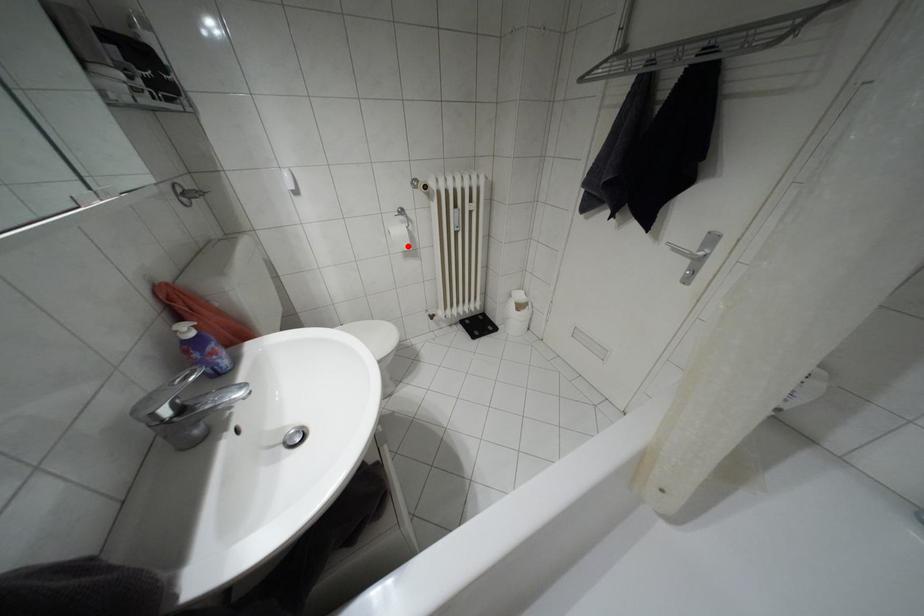
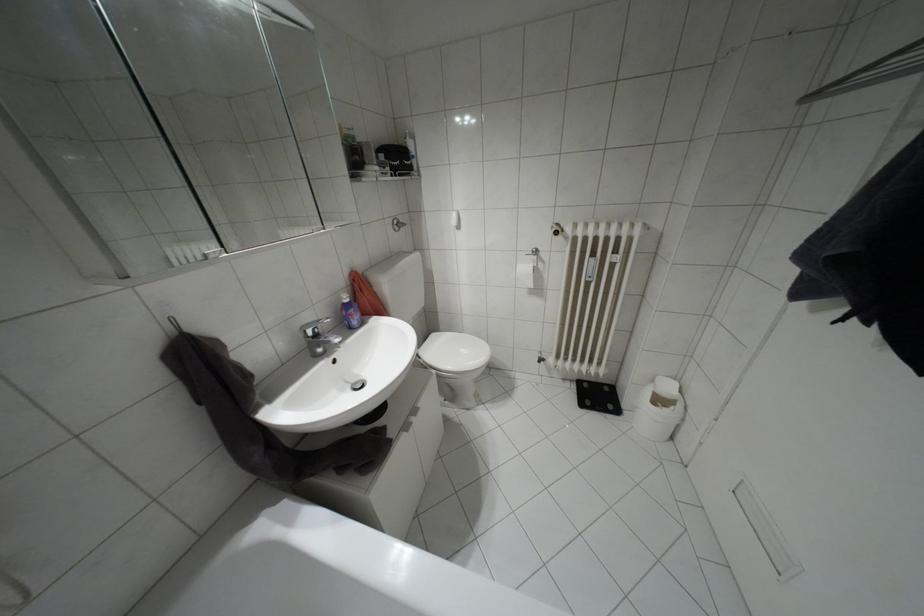
The point at the highlighted location is marked in the first image. Where is the corresponding point in the second image?

(530, 284)